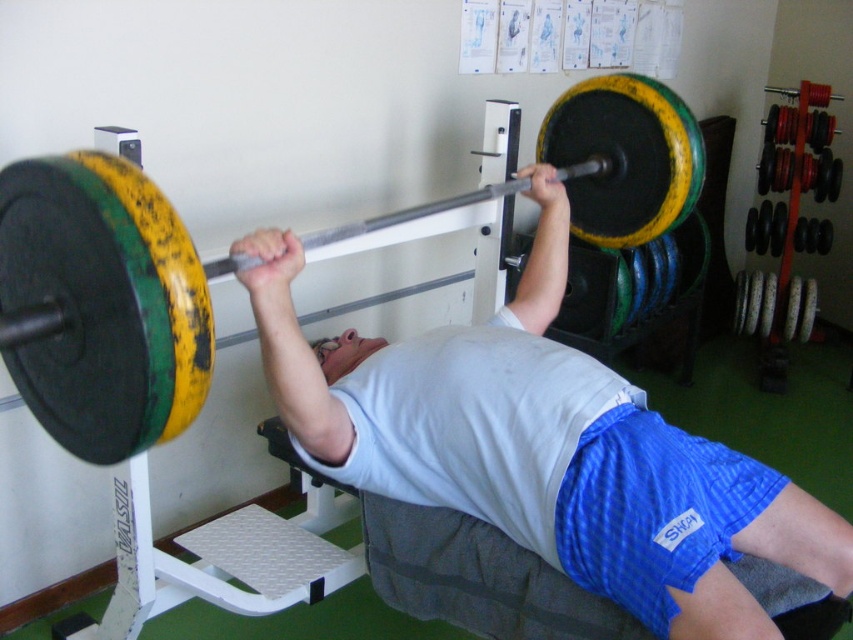
Question: Does matte black barbell at center have a greater width compared to yellow-green painted barbell at center?

Choices:
 (A) no
 (B) yes

Answer: (B)

Question: Among these objects, which one is nearest to the camera?

Choices:
 (A) yellow-green painted barbell at center
 (B) matte black barbell at center

Answer: (B)

Question: Which object appears closest to the camera in this image?

Choices:
 (A) yellow-green painted barbell at center
 (B) matte black barbell at center

Answer: (B)

Question: Can you confirm if matte black barbell at center is bigger than yellow-green painted barbell at center?

Choices:
 (A) yes
 (B) no

Answer: (A)

Question: Which point is closer to the camera?

Choices:
 (A) matte black barbell at center
 (B) yellow-green painted barbell at center

Answer: (A)

Question: Is matte black barbell at center below yellow-green painted barbell at center?

Choices:
 (A) no
 (B) yes

Answer: (B)